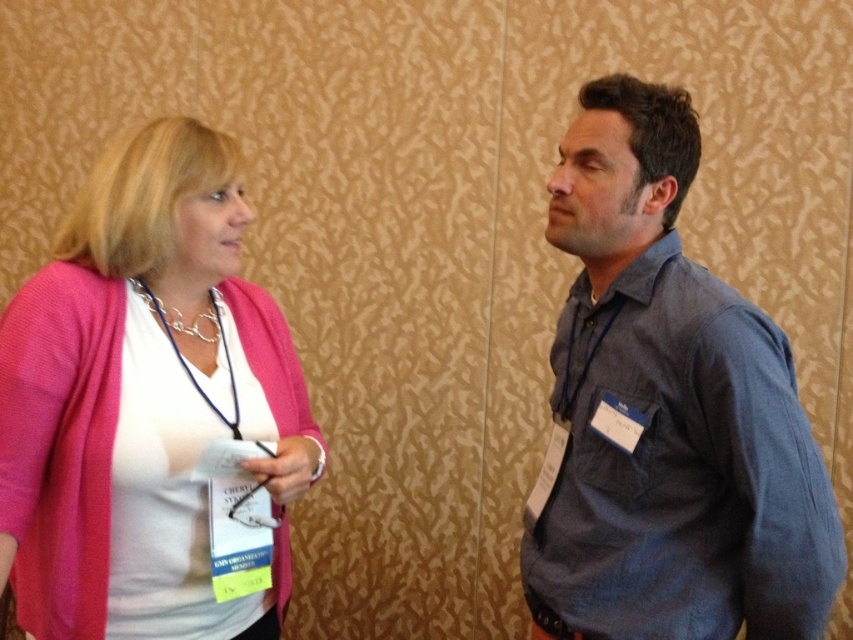
Question: Which point is farther to the camera?

Choices:
 (A) pink fabric sweater at left
 (B) blue denim shirt at right

Answer: (A)

Question: Is blue denim shirt at right to the left of pink fabric sweater at left from the viewer's perspective?

Choices:
 (A) no
 (B) yes

Answer: (A)

Question: Among these objects, which one is nearest to the camera?

Choices:
 (A) blue denim shirt at right
 (B) pink fabric sweater at left

Answer: (A)

Question: Does blue denim shirt at right appear on the left side of pink fabric sweater at left?

Choices:
 (A) yes
 (B) no

Answer: (B)

Question: Does blue denim shirt at right lie in front of pink fabric sweater at left?

Choices:
 (A) yes
 (B) no

Answer: (A)